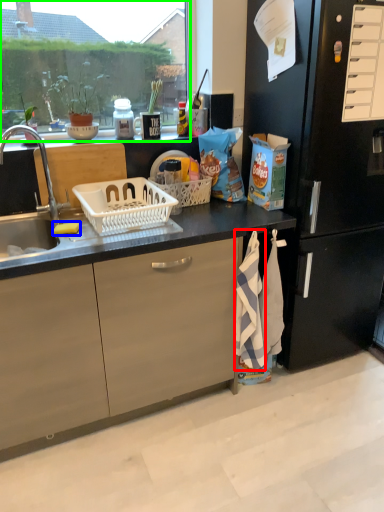
Question: Which object is positioned farthest from beach towel (highlighted by a red box)? Select from food (highlighted by a blue box) and window screen (highlighted by a green box).

Choices:
 (A) food
 (B) window screen

Answer: (B)